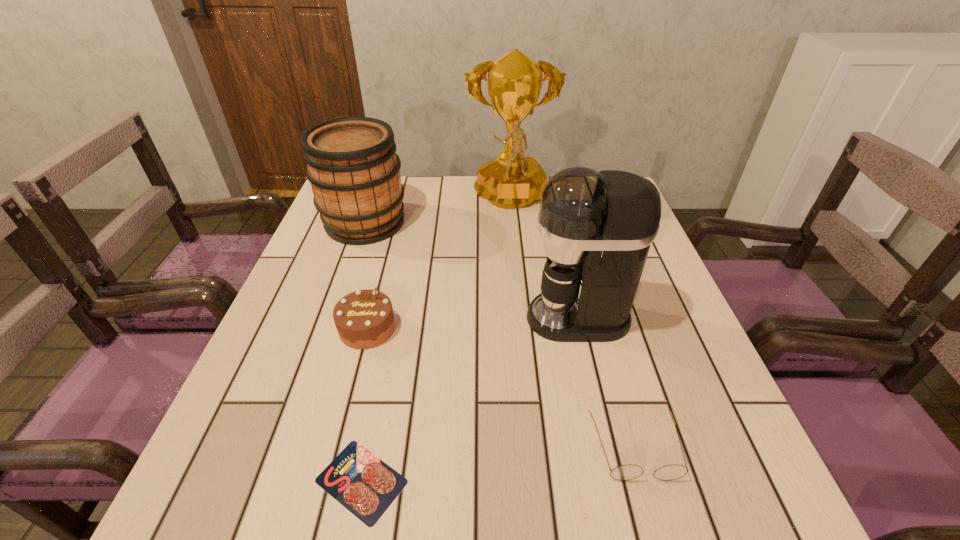
I want to click on award, so click(x=511, y=181).

Locate an element on the screen. This screenshot has width=960, height=540. the fifth shortest object is located at coordinates (597, 227).

What are the coordinates of `cider` in the screenshot? It's located at (352, 166).

Locate an element on the screen. This screenshot has width=960, height=540. chocolate cake is located at coordinates (364, 319).

This screenshot has height=540, width=960. Identify the location of spectacles. (624, 472).

This screenshot has width=960, height=540. In order to click on salami in this screenshot , I will do `click(366, 486)`.

Image resolution: width=960 pixels, height=540 pixels. What are the coordinates of `free space located 0.120m on the front side of the award` in the screenshot? It's located at (516, 252).

The height and width of the screenshot is (540, 960). Find the location of `vacant space situated 0.320m place cup under the spout of the second tallest object`. vacant space situated 0.320m place cup under the spout of the second tallest object is located at coordinates (375, 318).

You are a GUI agent. You are given a task and a screenshot of the screen. Output one action in this format:
    pyautogui.click(x=<x>, y=<y>)
    Task: Click on the vacant space located place cup under the spout of the second tallest object
    The height and width of the screenshot is (540, 960).
    Given the screenshot: What is the action you would take?
    pyautogui.click(x=466, y=318)

Where is `vacant area situated place cup under the spout of the second tallest object`? This screenshot has width=960, height=540. vacant area situated place cup under the spout of the second tallest object is located at coordinates coord(390,318).